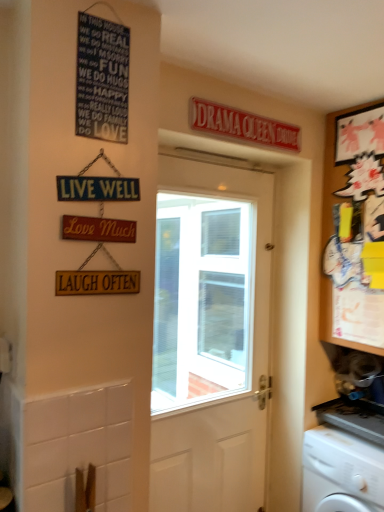
The width and height of the screenshot is (384, 512). What do you see at coordinates (102, 79) in the screenshot? I see `matte black signboard at upper left` at bounding box center [102, 79].

Locate an element on the screen. Image resolution: width=384 pixels, height=512 pixels. red plastic sign at upper center is located at coordinates (242, 125).

Does point (251, 122) appear closer or farther from the camera than point (354, 288)?

Point (251, 122) is closer to the camera than point (354, 288).

Would you say red plastic sign at upper center is outside wooden cabinet at right?

Yes, red plastic sign at upper center is not within wooden cabinet at right.

Who is more distant, red plastic sign at upper center or wooden cabinet at right?

wooden cabinet at right is further away from the camera.

Does red plastic sign at upper center turn towards wooden cabinet at right?

No.

The height and width of the screenshot is (512, 384). I want to click on parking sign that appears below the wooden cabinet at right (from a real-world perspective), so click(98, 229).

Is wooden signboard at center-left oriented towards wooden cabinet at right?

No, wooden signboard at center-left is not oriented towards wooden cabinet at right.

From the image's perspective, which is below, wooden signboard at center-left or wooden cabinet at right?

wooden signboard at center-left, from the image's perspective.

From a real-world perspective, is red plastic sign at upper center located higher than white wooden door at center?

Correct, in the physical world, red plastic sign at upper center is higher than white wooden door at center.

Is red plastic sign at upper center aimed at white wooden door at center?

No.

Considering the relative positions of red plastic sign at upper center and white wooden door at center in the image provided, is red plastic sign at upper center to the left or to the right of white wooden door at center?

red plastic sign at upper center is positioned on white wooden door at center's right side.

Is red plastic sign at upper center not within white wooden door at center?

That's correct, red plastic sign at upper center is outside of white wooden door at center.

Between matte black signboard at upper left and red plastic sign at upper center, which one has smaller size?

matte black signboard at upper left.

From a real-world perspective, which is physically below, matte black signboard at upper left or red plastic sign at upper center?

matte black signboard at upper left.

Is matte black signboard at upper left inside or outside of red plastic sign at upper center?

matte black signboard at upper left is spatially situated outside red plastic sign at upper center.

Does matte black signboard at upper left have a lesser height compared to red plastic sign at upper center?

No.

From a real-world perspective, is wooden cabinet at right positioned over white wooden door at center based on gravity?

Yes, from a real-world perspective, wooden cabinet at right is above white wooden door at center.

Can you tell me how much wooden cabinet at right and white wooden door at center differ in facing direction?

0.481 degrees separate the facing orientations of wooden cabinet at right and white wooden door at center.

Which point is more distant from viewer, (374, 232) or (166, 166)?

The point (374, 232) is farther from the camera.

Is wooden cabinet at right further to the viewer compared to white wooden door at center?

Yes, wooden cabinet at right is further from the camera.

Is wooden signboard at center-left not near red plastic sign at upper center?

wooden signboard at center-left is near red plastic sign at upper center, not far away.

Considering the relative sizes of wooden signboard at center-left and red plastic sign at upper center in the image provided, is wooden signboard at center-left thinner than red plastic sign at upper center?

Correct, the width of wooden signboard at center-left is less than that of red plastic sign at upper center.

Which is farther, (x=109, y=236) or (x=267, y=139)?

The point (x=267, y=139) is farther.

Does red plastic sign at upper center have a smaller size compared to wooden signboard at center-left?

No.

Is red plastic sign at upper center positioned beyond the bounds of wooden signboard at center-left?

Yes, red plastic sign at upper center is located beyond the bounds of wooden signboard at center-left.

From a real-world perspective, which object rests below the other?

From a 3D spatial view, wooden signboard at center-left is below.

The image size is (384, 512). In order to click on cabinetry located below the red plastic sign at upper center (from the image's perspective) in this screenshot , I will do point(353,228).

Where is `parking sign on the left of wooden cabinet at right`? The image size is (384, 512). parking sign on the left of wooden cabinet at right is located at coordinates (98, 229).

Consider the image. Considering their positions, is matte black signboard at upper left positioned closer to wooden signboard at center-left than white plastic washing machine at lower right?

matte black signboard at upper left lies closer to wooden signboard at center-left than the other object.

From the image, which object appears to be farther from red plastic sign at upper center, wooden cabinet at right or wooden signboard at center-left?

wooden signboard at center-left is further to red plastic sign at upper center.

Based on their spatial positions, is red plastic sign at upper center or white plastic washing machine at lower right further from wooden signboard at center-left?

white plastic washing machine at lower right.

Considering their positions, is red plastic sign at upper center positioned further to wooden signboard at center-left than matte black signboard at upper left?

red plastic sign at upper center is positioned further to the anchor wooden signboard at center-left.

Considering their positions, is wooden signboard at center-left positioned further to white wooden door at center than matte black signboard at upper left?

wooden signboard at center-left lies further to white wooden door at center than the other object.

Considering their positions, is wooden signboard at center-left positioned closer to white wooden door at center than red plastic sign at upper center?

Based on the image, red plastic sign at upper center appears to be nearer to white wooden door at center.

When comparing their distances from wooden signboard at center-left, does white wooden door at center or white plastic washing machine at lower right seem further?

white wooden door at center is positioned further to the anchor wooden signboard at center-left.

From the picture: Looking at the image, which one is located closer to matte black signboard at upper left, white wooden door at center or wooden signboard at center-left?

wooden signboard at center-left.

Image resolution: width=384 pixels, height=512 pixels. I want to click on door between matte black signboard at upper left and white plastic washing machine at lower right in the vertical direction, so click(211, 336).

Find the location of a particular element. This screenshot has width=384, height=512. signage located between wooden signboard at center-left and wooden cabinet at right in the left-right direction is located at coordinates (102, 79).

Identify the location of door between red plastic sign at upper center and white plastic washing machine at lower right in the up-down direction. This screenshot has height=512, width=384. (211, 336).

I want to click on sign located between matte black signboard at upper left and wooden cabinet at right in the left-right direction, so click(x=242, y=125).